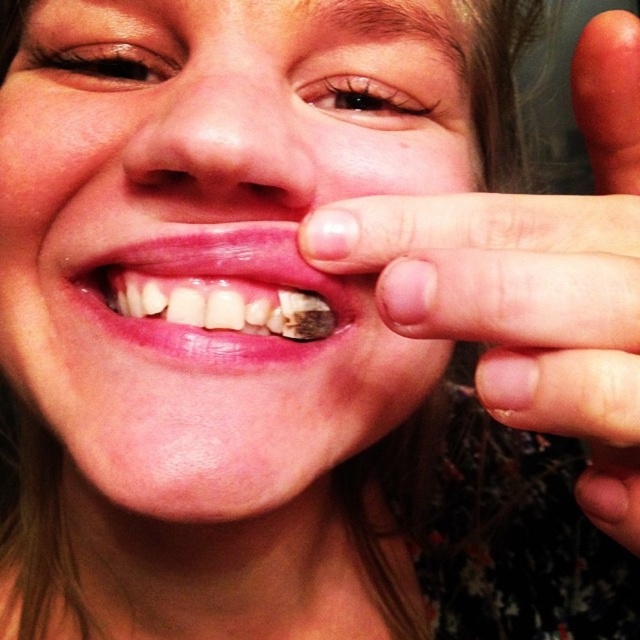
Based on the scene description, where is the smooth skin hand at right positioned in relation to the missing tooth?

The smooth skin hand at right is located at point (531, 282), which is near the missing tooth as it holds it between its fingers.

You are a photographer adjusting the focus on your camera. You want to ensure that the point at coordinates point (364, 24) is in sharp focus. Given that the camera can only focus on objects within 30 centimeters, will this point be in focus?

The point (364, 24) is 28.80 centimeters away from the camera, which is within the 30 centimeter range. Therefore, the point will be in focus.